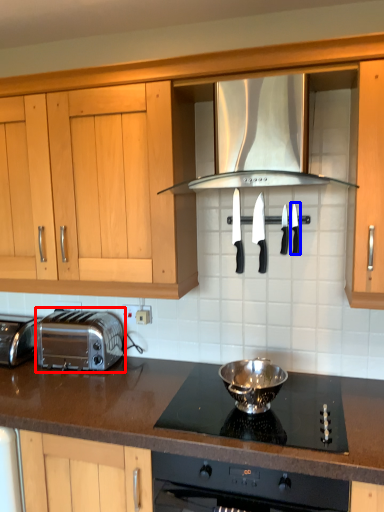
Question: Which object is closer to the camera taking this photo, toaster (highlighted by a red box) or kitchen appliance (highlighted by a blue box)?

Choices:
 (A) toaster
 (B) kitchen appliance

Answer: (B)